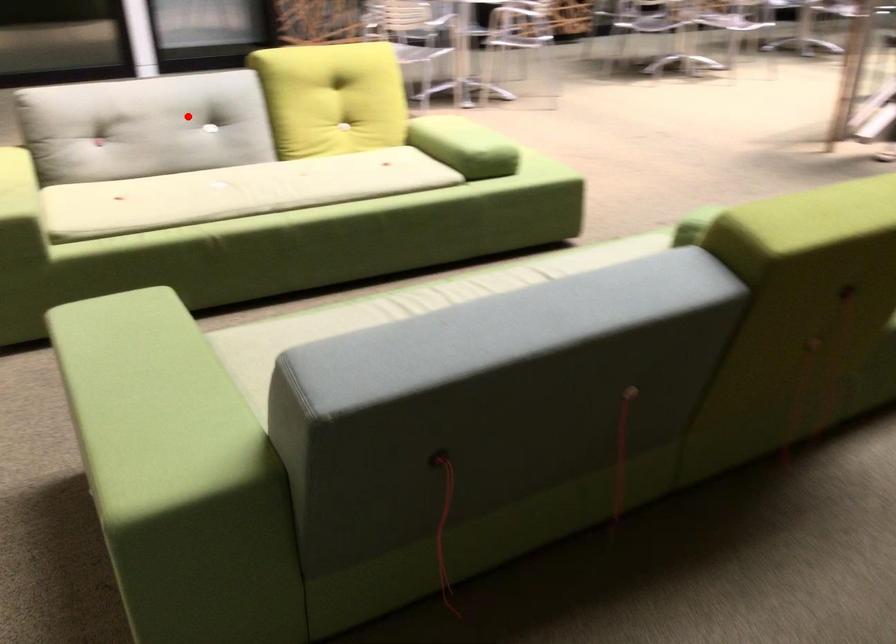
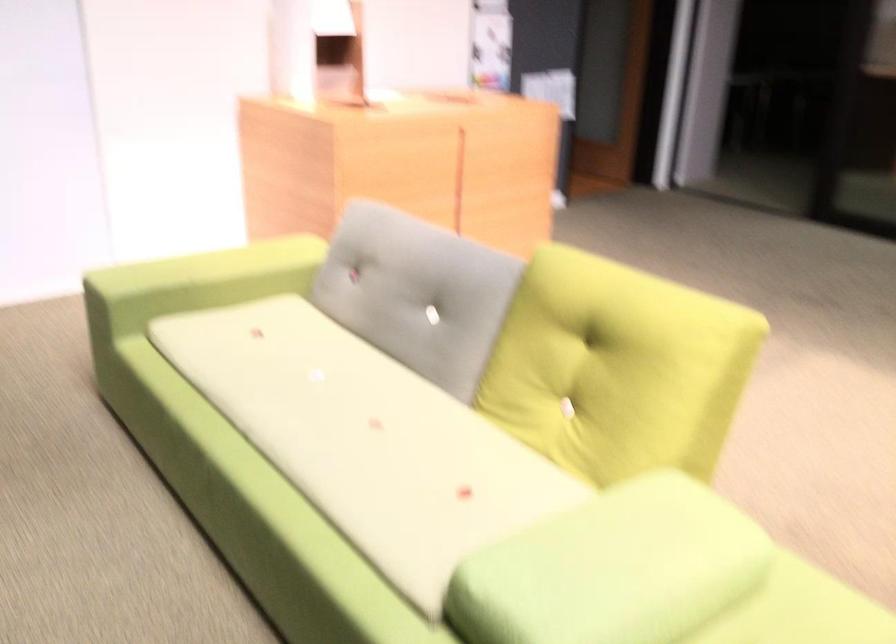
Question: A red point is marked in image1. In image2, is the corresponding 3D point closer to the camera or farther? Reply with the corresponding letter.

Choices:
 (A) The corresponding 3D point is closer.
 (B) The corresponding 3D point is farther.

Answer: (A)